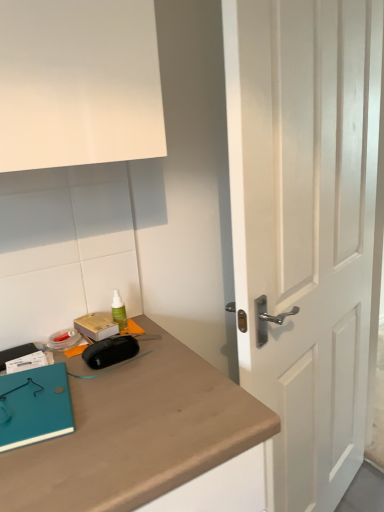
Question: Is teal matte notebook at lower left at the left side of green plastic spray bottle at upper center?

Choices:
 (A) yes
 (B) no

Answer: (A)

Question: From the image's perspective, would you say teal matte notebook at lower left is positioned over green plastic spray bottle at upper center?

Choices:
 (A) yes
 (B) no

Answer: (B)

Question: Is teal matte notebook at lower left positioned beyond the bounds of green plastic spray bottle at upper center?

Choices:
 (A) no
 (B) yes

Answer: (B)

Question: Does teal matte notebook at lower left have a smaller size compared to green plastic spray bottle at upper center?

Choices:
 (A) yes
 (B) no

Answer: (B)

Question: Does teal matte notebook at lower left lie behind green plastic spray bottle at upper center?

Choices:
 (A) no
 (B) yes

Answer: (A)

Question: Is teal matte notebook at lower left taller or shorter than green plastic spray bottle at upper center?

Choices:
 (A) tall
 (B) short

Answer: (B)

Question: Is teal matte notebook at lower left to the left or to the right of green plastic spray bottle at upper center in the image?

Choices:
 (A) right
 (B) left

Answer: (B)

Question: In terms of width, does teal matte notebook at lower left look wider or thinner when compared to green plastic spray bottle at upper center?

Choices:
 (A) wide
 (B) thin

Answer: (A)

Question: From the image's perspective, is teal matte notebook at lower left positioned above or below green plastic spray bottle at upper center?

Choices:
 (A) above
 (B) below

Answer: (B)

Question: Considering the positions of point (319, 297) and point (34, 398), is point (319, 297) closer or farther from the camera than point (34, 398)?

Choices:
 (A) farther
 (B) closer

Answer: (A)

Question: Based on their sizes in the image, would you say white wooden door at center is bigger or smaller than teal matte notebook at lower left?

Choices:
 (A) big
 (B) small

Answer: (A)

Question: Is white wooden door at center situated inside teal matte notebook at lower left or outside?

Choices:
 (A) outside
 (B) inside

Answer: (A)

Question: From their relative heights in the image, would you say white wooden door at center is taller or shorter than teal matte notebook at lower left?

Choices:
 (A) short
 (B) tall

Answer: (B)

Question: From the image's perspective, is teal matte notebook at lower left above or below white wooden door at center?

Choices:
 (A) below
 (B) above

Answer: (A)

Question: In terms of height, does teal matte notebook at lower left look taller or shorter compared to white wooden door at center?

Choices:
 (A) tall
 (B) short

Answer: (B)